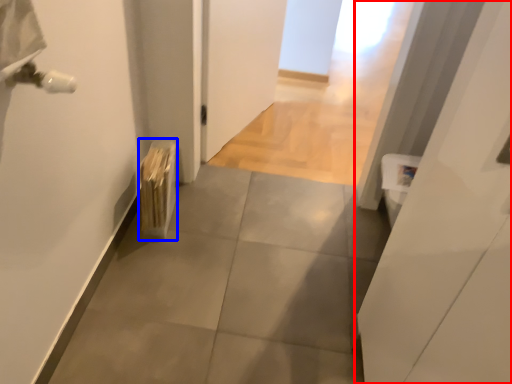
Question: Among these objects, which one is nearest to the camera, door (highlighted by a red box) or radiator (highlighted by a blue box)?

Choices:
 (A) door
 (B) radiator

Answer: (A)